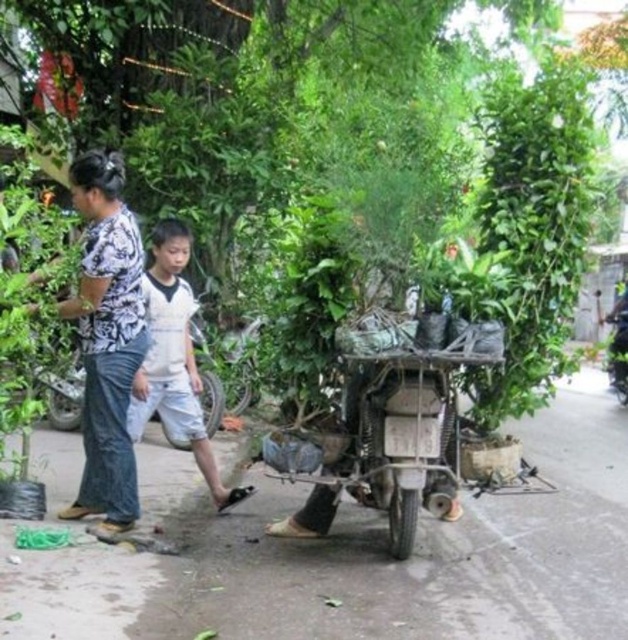
In the scene shown: Which of these two, white cotton shirt at center or metallic silver tricycle at center, stands taller?

white cotton shirt at center

Does white cotton shirt at center appear on the left side of metallic silver tricycle at center?

Yes, white cotton shirt at center is to the left of metallic silver tricycle at center.

Who is more distant from viewer, (192, 300) or (615, 364)?

Positioned behind is point (615, 364).

The height and width of the screenshot is (640, 628). I want to click on white cotton shirt at center, so click(x=175, y=356).

Describe the element at coordinates (106, 339) in the screenshot. I see `printed fabric shirt at center` at that location.

At what (x,y) coordinates should I click in order to perform the action: click on printed fabric shirt at center. Please return your answer as a coordinate pair (x, y). Looking at the image, I should click on (106, 339).

Locate an element on the screen. The image size is (628, 640). printed fabric shirt at center is located at coordinates (106, 339).

Image resolution: width=628 pixels, height=640 pixels. Find the location of `printed fabric shirt at center`. printed fabric shirt at center is located at coordinates (106, 339).

Who is shorter, printed fabric shirt at center or metallic silver tricycle at center?

metallic silver tricycle at center is shorter.

Can you confirm if printed fabric shirt at center is smaller than metallic silver tricycle at center?

Yes.

Is point (134, 268) farther from viewer compared to point (619, 342)?

No, it is not.

The width and height of the screenshot is (628, 640). I want to click on printed fabric shirt at center, so 106,339.